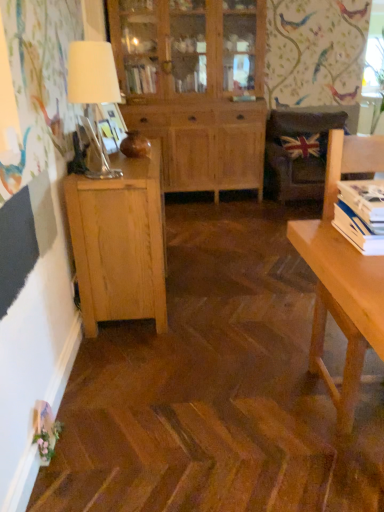
The height and width of the screenshot is (512, 384). What do you see at coordinates (120, 242) in the screenshot?
I see `natural wood cabinet at left, which appears as the first cabinetry when ordered from the bottom` at bounding box center [120, 242].

The width and height of the screenshot is (384, 512). What do you see at coordinates (361, 215) in the screenshot? I see `white paper stack at right` at bounding box center [361, 215].

Find the location of a particular element. This screenshot has width=384, height=512. brown leather chair at center is located at coordinates (298, 153).

The width and height of the screenshot is (384, 512). I want to click on natural wood cabinet at center, the 1th cabinetry from the back, so (x=195, y=87).

At what (x,y) coordinates should I click in order to perform the action: click on union jack fabric pillow at upper right. Please return your answer as a coordinate pair (x, y). The height and width of the screenshot is (512, 384). Looking at the image, I should click on (305, 145).

Identify the location of natural wood cabinet at left, which is the second cabinetry in back-to-front order. This screenshot has width=384, height=512. (120, 242).

Identify the location of book below the natural wood cabinet at left, the 2th cabinetry viewed from the top (from the image's perspective). (361, 215).

Which of these two, white paper stack at right or natural wood cabinet at left, the 2th cabinetry viewed from the top, is thinner?

Thinner between the two is white paper stack at right.

Between white paper stack at right and natural wood cabinet at left, which appears as the first cabinetry when viewed from the front, which one appears on the right side from the viewer's perspective?

From the viewer's perspective, white paper stack at right appears more on the right side.

Does point (360, 232) come farther from viewer compared to point (153, 178)?

No, it is in front of (153, 178).

The height and width of the screenshot is (512, 384). In the image, there is a matte white lampshade at left. In order to click on cabinetry above it (from the image's perspective) in this screenshot , I will do `click(195, 87)`.

From the image's perspective, which is above, natural wood cabinet at center, which is counted as the second cabinetry, starting from the front, or matte white lampshade at left?

natural wood cabinet at center, which is counted as the second cabinetry, starting from the front, is shown above in the image.

Is natural wood cabinet at center, which is counted as the second cabinetry, starting from the front, surrounding matte white lampshade at left?

No, natural wood cabinet at center, which is counted as the second cabinetry, starting from the front, does not contain matte white lampshade at left.

What's the angular difference between natural wood cabinet at center, the 1th cabinetry from the back, and matte white lampshade at left's facing directions?

The angular difference between natural wood cabinet at center, the 1th cabinetry from the back, and matte white lampshade at left is 92.5 degrees.

From the image's perspective, is brown leather chair at center located beneath union jack fabric pillow at upper right?

Indeed, from the image's perspective, brown leather chair at center is shown beneath union jack fabric pillow at upper right.

Which object is wider, brown leather chair at center or union jack fabric pillow at upper right?

brown leather chair at center.

Is brown leather chair at center to the right of union jack fabric pillow at upper right from the viewer's perspective?

Yes.

Image resolution: width=384 pixels, height=512 pixels. Find the location of `pillow located on the left of brown leather chair at center`. pillow located on the left of brown leather chair at center is located at coordinates (305, 145).

Does light brown wooden desk at right have a lesser width compared to brown leather chair at center?

Yes, light brown wooden desk at right is thinner than brown leather chair at center.

From a real-world perspective, is light brown wooden desk at right on top of brown leather chair at center?

Yes, from a real-world perspective, light brown wooden desk at right is above brown leather chair at center.

From the image's perspective, is light brown wooden desk at right under brown leather chair at center?

Yes, from the image's perspective, light brown wooden desk at right is beneath brown leather chair at center.

From a real-world perspective, is matte white lampshade at left below union jack fabric pillow at upper right?

Incorrect, from a real-world perspective, matte white lampshade at left is higher than union jack fabric pillow at upper right.

Between matte white lampshade at left and union jack fabric pillow at upper right, which one has larger width?

matte white lampshade at left is wider.

Based on their positions, is matte white lampshade at left located to the left or right of union jack fabric pillow at upper right?

matte white lampshade at left is to the left of union jack fabric pillow at upper right.

Considering the sizes of objects matte white lampshade at left and union jack fabric pillow at upper right in the image provided, who is bigger, matte white lampshade at left or union jack fabric pillow at upper right?

With larger size is matte white lampshade at left.

Is point (302, 145) less distant than point (336, 206)?

No, (302, 145) is behind (336, 206).

Consider the image. Is union jack fabric pillow at upper right positioned with its back to white paper stack at right?

That's not correct — union jack fabric pillow at upper right is not looking away from white paper stack at right.

From the image's perspective, which is above, union jack fabric pillow at upper right or white paper stack at right?

From the image's view, union jack fabric pillow at upper right is above.

Does light brown wooden desk at right lie behind natural wood cabinet at left, the 2th cabinetry viewed from the top?

No, light brown wooden desk at right is closer to the camera.

Which of these two, light brown wooden desk at right or natural wood cabinet at left, which appears as the first cabinetry when ordered from the bottom, stands taller?

With more height is light brown wooden desk at right.

From the light brown wooden desk at right, count the 2nd cabinetry to the left and point to it. Please provide its 2D coordinates.

[(120, 242)]

Between light brown wooden desk at right and natural wood cabinet at left, which appears as the first cabinetry when viewed from the front, which one has larger width?

Wider between the two is light brown wooden desk at right.

The image size is (384, 512). What are the coordinates of `book lying on the right of natural wood cabinet at left, the 2th cabinetry viewed from the top` in the screenshot? It's located at (361, 215).

There is a matte white lampshade at left. What are the coordinates of `the 1st cabinetry below it (from a real-world perspective)` in the screenshot? It's located at (195, 87).

When comparing their distances from white paper stack at right, does brown leather chair at center or matte white lampshade at left seem closer?

Among the two, matte white lampshade at left is located nearer to white paper stack at right.

Based on their spatial positions, is union jack fabric pillow at upper right or white paper stack at right closer to natural wood cabinet at center, which is counted as the second cabinetry, starting from the front?

Based on the image, union jack fabric pillow at upper right appears to be nearer to natural wood cabinet at center, which is counted as the second cabinetry, starting from the front.

Based on their spatial positions, is light brown wooden desk at right or natural wood cabinet at left, the 2th cabinetry viewed from the top, closer to white paper stack at right?

Among the two, light brown wooden desk at right is located nearer to white paper stack at right.

Consider the image. When comparing their distances from brown leather chair at center, does matte white lampshade at left or light brown wooden desk at right seem closer?

matte white lampshade at left is positioned closer to the anchor brown leather chair at center.

Based on the photo, looking at the image, which one is located further to natural wood cabinet at left, the 2th cabinetry viewed from the top, brown leather chair at center or union jack fabric pillow at upper right?

Among the two, union jack fabric pillow at upper right is located further to natural wood cabinet at left, the 2th cabinetry viewed from the top.

Considering their positions, is matte white lampshade at left positioned closer to natural wood cabinet at left, which appears as the first cabinetry when viewed from the front, than light brown wooden desk at right?

matte white lampshade at left is positioned closer to the anchor natural wood cabinet at left, which appears as the first cabinetry when viewed from the front.

When comparing their distances from natural wood cabinet at center, the 1th cabinetry from the back, does light brown wooden desk at right or natural wood cabinet at left, which appears as the first cabinetry when ordered from the bottom, seem closer?

The object closer to natural wood cabinet at center, the 1th cabinetry from the back, is natural wood cabinet at left, which appears as the first cabinetry when ordered from the bottom.

Looking at the image, which one is located further to natural wood cabinet at left, which appears as the first cabinetry when ordered from the bottom, light brown wooden desk at right or union jack fabric pillow at upper right?

union jack fabric pillow at upper right.

Where is `book between matte white lampshade at left and light brown wooden desk at right`? The height and width of the screenshot is (512, 384). book between matte white lampshade at left and light brown wooden desk at right is located at coordinates (361, 215).

In order to click on chair located between matte white lampshade at left and union jack fabric pillow at upper right in the depth direction in this screenshot , I will do `click(298, 153)`.

This screenshot has height=512, width=384. I want to click on table lamp located between white paper stack at right and union jack fabric pillow at upper right in the depth direction, so click(92, 73).

This screenshot has width=384, height=512. In order to click on cabinetry between natural wood cabinet at left, which appears as the first cabinetry when ordered from the bottom, and union jack fabric pillow at upper right, along the z-axis in this screenshot , I will do pyautogui.click(x=195, y=87).